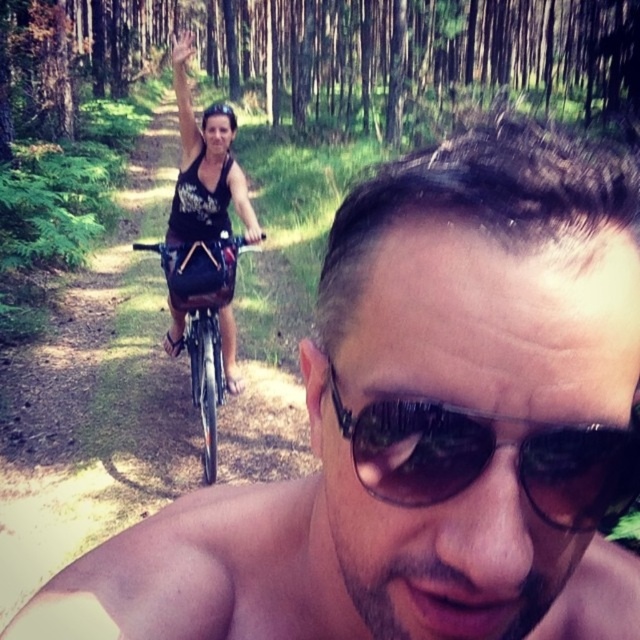
Question: Can you confirm if green leafy forest at upper center is positioned to the right of black reflective sunglasses at center?

Choices:
 (A) no
 (B) yes

Answer: (A)

Question: Is green leafy forest at upper center wider than black reflective sunglasses at center?

Choices:
 (A) yes
 (B) no

Answer: (A)

Question: Which of the following is the farthest from the observer?

Choices:
 (A) (356, 440)
 (B) (195, 368)

Answer: (B)

Question: Is black reflective sunglasses at center closer to the viewer compared to silver metallic bicycle at center?

Choices:
 (A) no
 (B) yes

Answer: (B)

Question: Which point is closer to the camera?

Choices:
 (A) black matte bicycle helmet at upper center
 (B) silver metallic bicycle at center
 (C) green leafy forest at upper center

Answer: (B)

Question: Which point appears farthest from the camera in this image?

Choices:
 (A) (0, 141)
 (B) (205, 326)
 (C) (205, 108)
 (D) (180, 314)

Answer: (C)